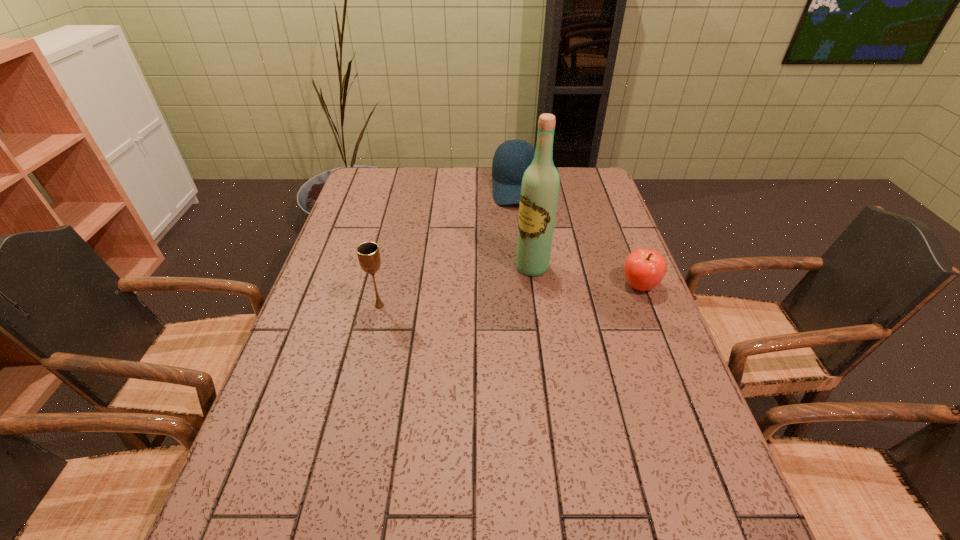
The height and width of the screenshot is (540, 960). In order to click on vacant space located 0.260m on the front-facing side of the farthest object in this screenshot , I will do `click(519, 259)`.

I want to click on free space located 0.160m on the front-facing side of the farthest object, so click(518, 238).

Find the location of a particular element. The width and height of the screenshot is (960, 540). free region located 0.120m on the front-facing side of the wine bottle is located at coordinates (487, 292).

Locate an element on the screen. This screenshot has width=960, height=540. free space located on the front-facing side of the wine bottle is located at coordinates (481, 295).

You are a GUI agent. You are given a task and a screenshot of the screen. Output one action in this format:
    pyautogui.click(x=<x>, y=<y>)
    Task: Click on the vacant space located on the front-facing side of the wine bottle
    
    Given the screenshot: What is the action you would take?
    pyautogui.click(x=435, y=321)

In order to click on object located at the far edge in this screenshot , I will do `click(507, 170)`.

Image resolution: width=960 pixels, height=540 pixels. Find the location of `object located at the right edge`. object located at the right edge is located at coordinates (644, 269).

At what (x,y) coordinates should I click in order to perform the action: click on vacant space at the far edge. Please return your answer as a coordinate pair (x, y). Looking at the image, I should click on (405, 191).

Find the location of a particular element. vacant area at the near edge of the desktop is located at coordinates coord(444,464).

In the image, there is a desktop. Identify the location of vacant space at the left edge. This screenshot has width=960, height=540. (317, 444).